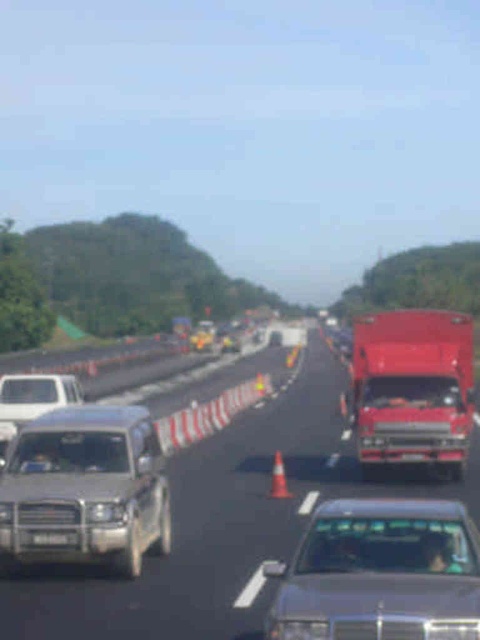
Question: Which point is closer to the camera?

Choices:
 (A) (148, 445)
 (B) (64, 376)

Answer: (A)

Question: Which point is closer to the camera?

Choices:
 (A) (121, 541)
 (B) (369, 524)
 (C) (35, 538)
 (D) (386, 323)

Answer: (B)

Question: Does metallic silver truck at center have a larger size compared to silver metallic suv at center?

Choices:
 (A) no
 (B) yes

Answer: (B)

Question: Considering the relative positions of silver metallic suv at center and black plastic license plate at center in the image provided, where is silver metallic suv at center located with respect to black plastic license plate at center?

Choices:
 (A) above
 (B) below

Answer: (A)

Question: Which of these objects is positioned farthest from the silver metallic suv at center?

Choices:
 (A) metallic silver sedan at center
 (B) white matte truck at left
 (C) shiny red truck at center
 (D) metallic silver truck at center

Answer: (B)

Question: Does metallic silver sedan at center appear under white matte truck at left?

Choices:
 (A) no
 (B) yes

Answer: (B)